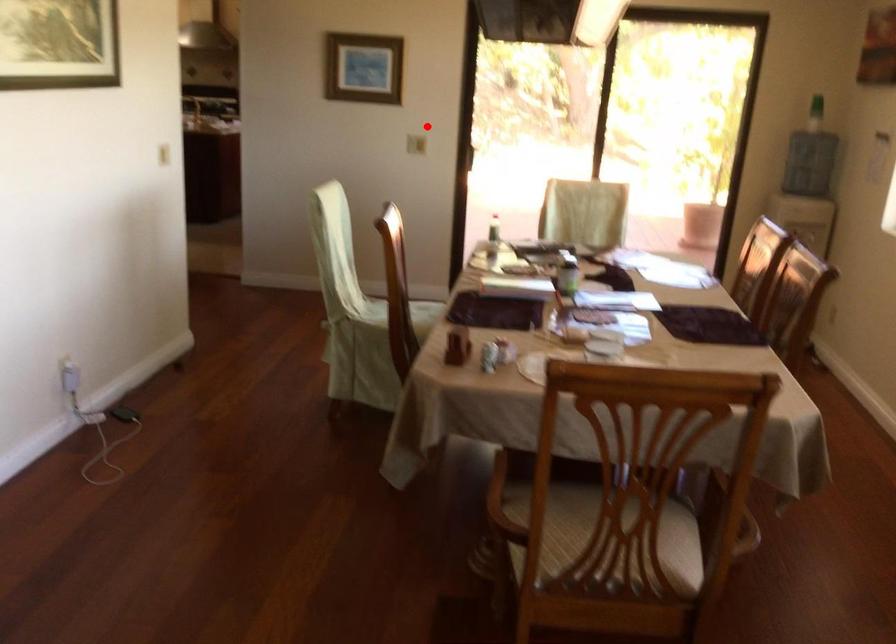
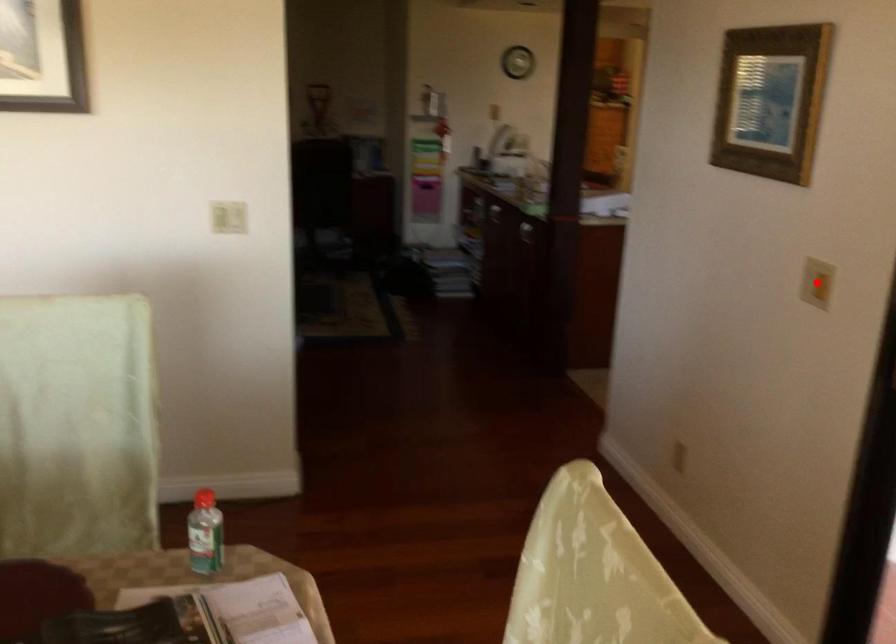
I am providing you with two images of the same scene from different viewpoints. A red point is marked on the first image and another point is marked on the second image. Is the red point in image1 aligned with the point shown in image2?

Yes